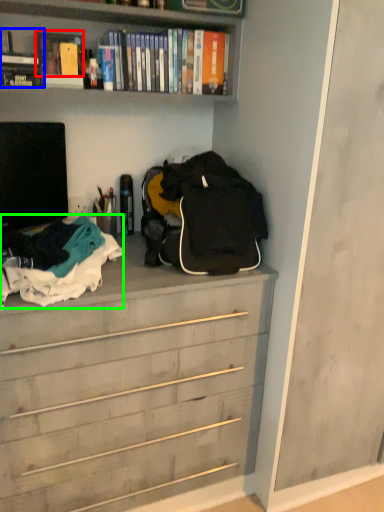
Question: Considering the real-world distances, which object is farthest from book (highlighted by a red box)? book (highlighted by a blue box) or clothing (highlighted by a green box)?

Choices:
 (A) book
 (B) clothing

Answer: (B)